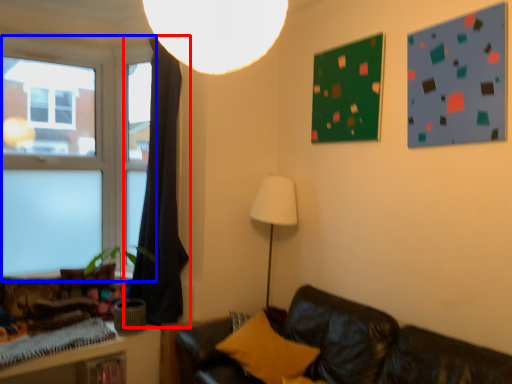
Question: Which object is further to the camera taking this photo, curtain (highlighted by a red box) or window (highlighted by a blue box)?

Choices:
 (A) curtain
 (B) window

Answer: (B)